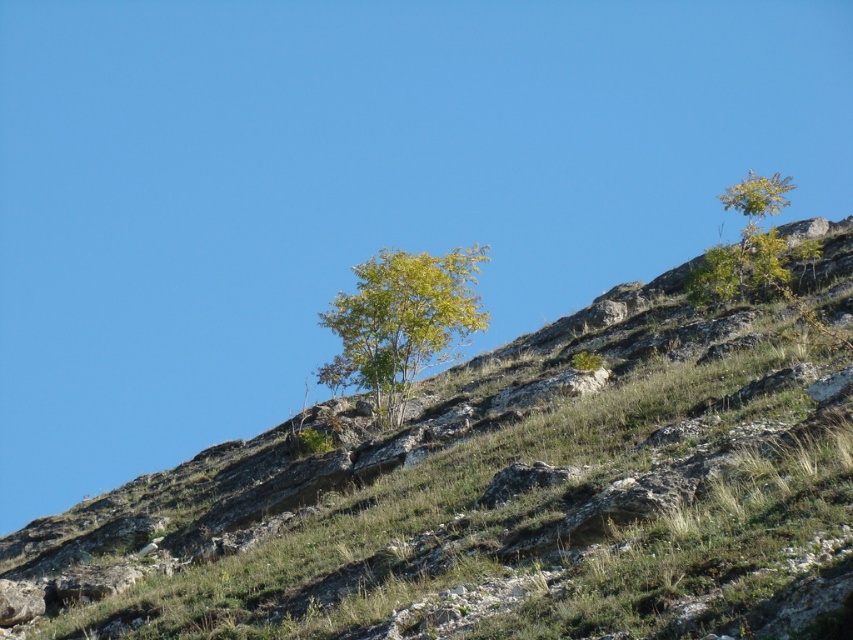
Is point (421, 365) farther from camera compared to point (769, 248)?

Yes, point (421, 365) is behind point (769, 248).

Is green leafy tree at center thinner than green leafy tree at upper right?

Indeed, green leafy tree at center has a lesser width compared to green leafy tree at upper right.

Locate an element on the screen. This screenshot has width=853, height=640. green leafy tree at center is located at coordinates (401, 323).

Does green grassy hillside at upper center appear under green leafy tree at center?

Yes.

Locate an element on the screen. This screenshot has width=853, height=640. green grassy hillside at upper center is located at coordinates (508, 492).

Is green grassy hillside at upper center shorter than green leafy tree at upper right?

Indeed, green grassy hillside at upper center has a lesser height compared to green leafy tree at upper right.

Can you confirm if green grassy hillside at upper center is positioned to the right of green leafy tree at upper right?

No, green grassy hillside at upper center is not to the right of green leafy tree at upper right.

Where is `green grassy hillside at upper center`? green grassy hillside at upper center is located at coordinates (508, 492).

Identify the location of green grassy hillside at upper center. (508, 492).